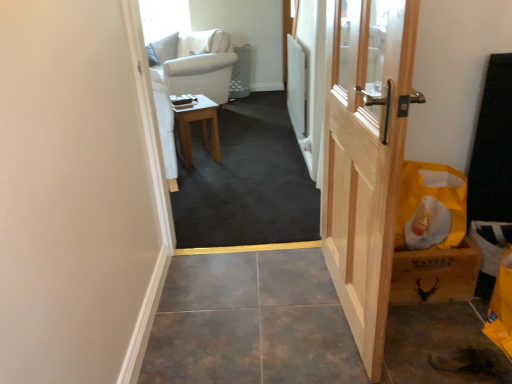
Question: Does yellow paper bag at right appear on the right side of natural wood door at right?

Choices:
 (A) yes
 (B) no

Answer: (A)

Question: Is there a large distance between yellow paper bag at right and natural wood door at right?

Choices:
 (A) yes
 (B) no

Answer: (B)

Question: From a real-world perspective, is yellow paper bag at right located higher than natural wood door at right?

Choices:
 (A) no
 (B) yes

Answer: (A)

Question: From a real-world perspective, is yellow paper bag at right located beneath natural wood door at right?

Choices:
 (A) yes
 (B) no

Answer: (A)

Question: Is yellow paper bag at right oriented away from natural wood door at right?

Choices:
 (A) no
 (B) yes

Answer: (A)

Question: Would you say yellow paper bag at right is outside natural wood door at right?

Choices:
 (A) yes
 (B) no

Answer: (A)

Question: Is natural wood door at right smaller than carpeted floor at center?

Choices:
 (A) yes
 (B) no

Answer: (A)

Question: From a real-world perspective, is natural wood door at right beneath carpeted floor at center?

Choices:
 (A) no
 (B) yes

Answer: (A)

Question: Is natural wood door at right located outside carpeted floor at center?

Choices:
 (A) yes
 (B) no

Answer: (A)

Question: Is natural wood door at right behind carpeted floor at center?

Choices:
 (A) no
 (B) yes

Answer: (A)

Question: Does natural wood door at right come in front of carpeted floor at center?

Choices:
 (A) yes
 (B) no

Answer: (A)

Question: Is natural wood door at right oriented away from carpeted floor at center?

Choices:
 (A) no
 (B) yes

Answer: (A)

Question: Considering the relative positions of yellow paper bag at right and carpeted floor at center in the image provided, is yellow paper bag at right to the right of carpeted floor at center from the viewer's perspective?

Choices:
 (A) yes
 (B) no

Answer: (A)